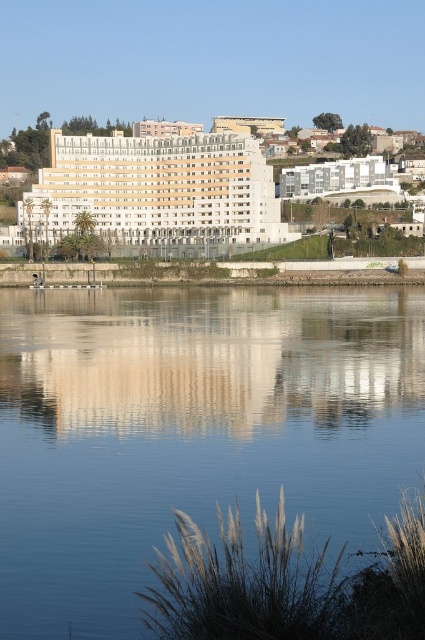
You are a boat captain trying to navigate your vessel through the river. The boat requires a minimum of 90 feet of clearance between the blue glassy water at center and the white smooth building at center to safely pass. Can you determine if there is enough space?

The blue glassy water at center is 100.29 feet from the white smooth building at center, which is more than the required 90 feet clearance. Therefore, the boat can safely pass through the area between the blue glassy water at center and the white smooth building at center.

You are standing on the concrete embankment and notice the blue glassy water at center and the white smooth building at center. Which object is positioned to the right of the other?

The blue glassy water at center is to the right of the white smooth building at center.

In the scene shown: You are standing at the riverside and want to take a photo. There are two points marked in the scene. The first point is at coordinates point (314,452) and the second point is at point (176,192). Which point will appear larger in your photo?

Point (314,452) is closer to the camera than point (176,192), so it will appear larger in the photo.